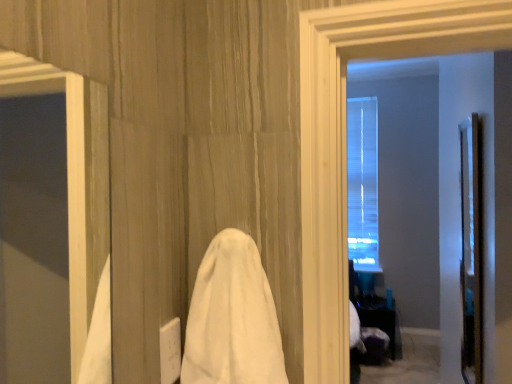
Question: Is white cloth at center thinner than clear glass door at right?

Choices:
 (A) no
 (B) yes

Answer: (A)

Question: From the image's perspective, is white cloth at center located above clear glass door at right?

Choices:
 (A) yes
 (B) no

Answer: (B)

Question: Does white cloth at center have a greater width compared to clear glass door at right?

Choices:
 (A) yes
 (B) no

Answer: (A)

Question: From the image's perspective, is white cloth at center under clear glass door at right?

Choices:
 (A) no
 (B) yes

Answer: (B)

Question: Is white cloth at center smaller than clear glass door at right?

Choices:
 (A) no
 (B) yes

Answer: (B)

Question: Is white cloth at center bigger than clear glass door at right?

Choices:
 (A) no
 (B) yes

Answer: (A)

Question: Considering the relative sizes of black glossy table at lower right and white cloth at center in the image provided, is black glossy table at lower right wider than white cloth at center?

Choices:
 (A) no
 (B) yes

Answer: (B)

Question: Is black glossy table at lower right in contact with white cloth at center?

Choices:
 (A) no
 (B) yes

Answer: (A)

Question: Is black glossy table at lower right not within white cloth at center?

Choices:
 (A) yes
 (B) no

Answer: (A)

Question: Considering the relative sizes of black glossy table at lower right and white cloth at center in the image provided, is black glossy table at lower right bigger than white cloth at center?

Choices:
 (A) no
 (B) yes

Answer: (B)

Question: Is black glossy table at lower right at the right side of white cloth at center?

Choices:
 (A) no
 (B) yes

Answer: (B)

Question: Is white cloth at center at the back of black glossy table at lower right?

Choices:
 (A) yes
 (B) no

Answer: (B)

Question: Can you confirm if clear glass door at right is smaller than black glossy table at lower right?

Choices:
 (A) yes
 (B) no

Answer: (A)